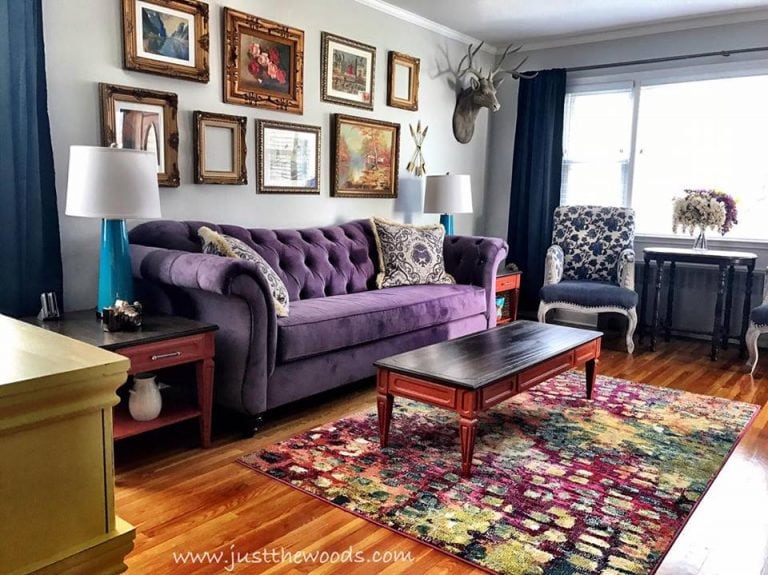
Where is `blue and white chairs`? This screenshot has width=768, height=575. blue and white chairs is located at coordinates (584, 247), (765, 298).